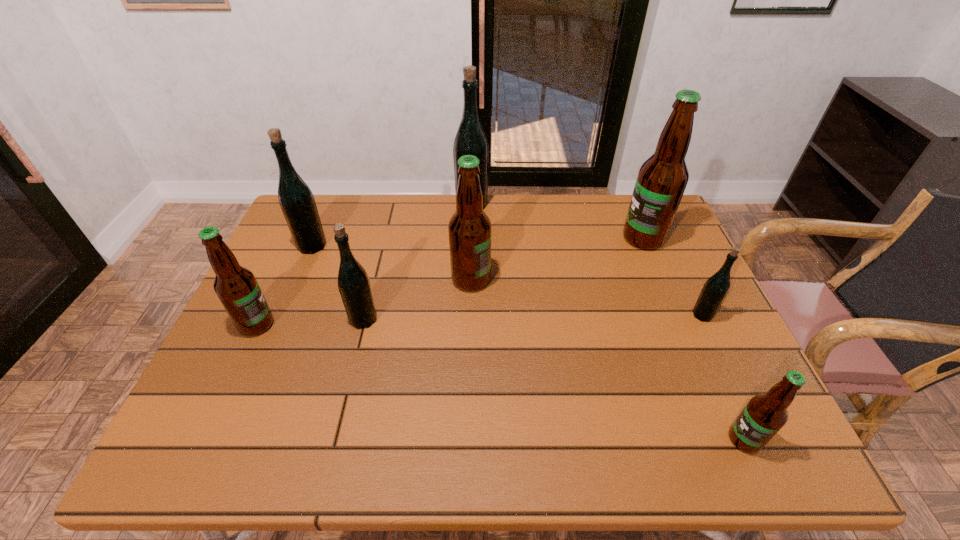
Identify the location of vacant region between the second green beer bottle from left to right and the farthest object. The height and width of the screenshot is (540, 960). (418, 262).

Locate an element on the screen. vacant area that lies between the fifth nearest object and the smallest brown beer bottle is located at coordinates (608, 359).

Locate an element on the screen. Image resolution: width=960 pixels, height=540 pixels. vacant area that lies between the second nearest brown beer bottle and the nearest beer bottle is located at coordinates (500, 382).

Where is `free space that is in between the third biggest brown beer bottle and the rightmost green beer bottle`? The height and width of the screenshot is (540, 960). free space that is in between the third biggest brown beer bottle and the rightmost green beer bottle is located at coordinates (480, 320).

Locate an element on the screen. The image size is (960, 540). object that can be found as the seventh closest to the rightmost green beer bottle is located at coordinates (236, 286).

The height and width of the screenshot is (540, 960). I want to click on the third closest object to the second smallest brown beer bottle, so click(469, 228).

I want to click on beer bottle that is the second closest one to the farthest brown beer bottle, so click(469, 228).

The width and height of the screenshot is (960, 540). Find the location of `the second closest beer bottle to the second farthest green beer bottle`. the second closest beer bottle to the second farthest green beer bottle is located at coordinates (353, 282).

At what (x,y) coordinates should I click in order to perform the action: click on green beer bottle that can be found as the second closest to the third smallest brown beer bottle. Please return your answer as a coordinate pair (x, y). Looking at the image, I should click on [x=470, y=139].

Point out which green beer bottle is positioned as the nearest to the second smallest green beer bottle. Please provide its 2D coordinates. Your answer should be formatted as a tuple, i.e. [(x, y)], where the tuple contains the x and y coordinates of a point satisfying the conditions above.

[(296, 200)]